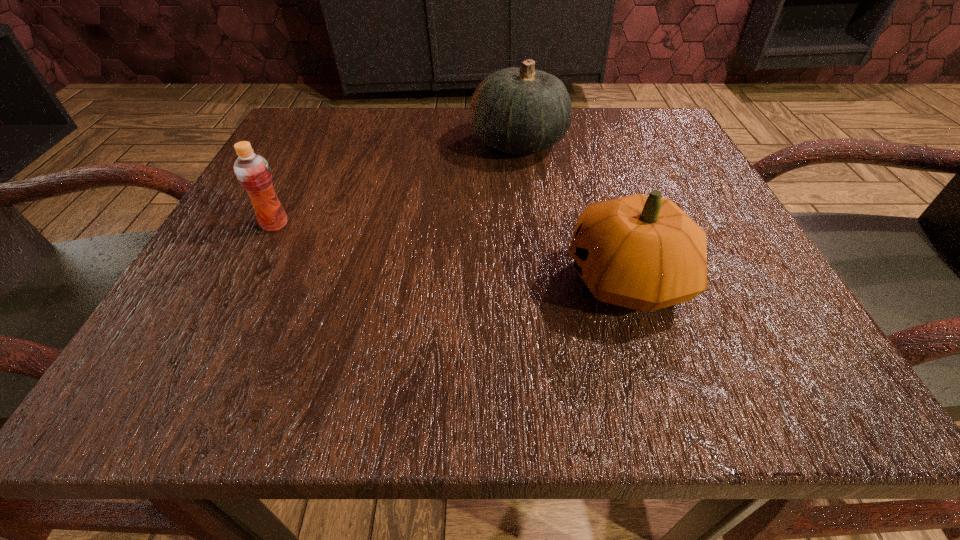
The height and width of the screenshot is (540, 960). I want to click on object present at the left edge, so click(x=252, y=170).

Find the location of a particular element. object that is at the right edge is located at coordinates (643, 252).

At what (x,y) coordinates should I click in order to perform the action: click on vacant region at the far edge of the desktop. Please return your answer as a coordinate pair (x, y). The width and height of the screenshot is (960, 540). Looking at the image, I should click on (574, 159).

This screenshot has height=540, width=960. I want to click on vacant space at the near edge, so click(633, 380).

The image size is (960, 540). I want to click on vacant position at the left edge of the desktop, so click(241, 244).

I want to click on free location at the right edge of the desktop, so click(x=758, y=277).

The height and width of the screenshot is (540, 960). Identify the location of vacant space at the far left corner of the desktop. (291, 168).

This screenshot has width=960, height=540. In the image, there is a desktop. In order to click on vacant space at the far right corner in this screenshot , I will do `click(620, 168)`.

Locate an element on the screen. This screenshot has height=540, width=960. vacant space at the near right corner of the desktop is located at coordinates pyautogui.click(x=836, y=403).

At what (x,y) coordinates should I click in order to perform the action: click on vacant area between the nearest object and the second farthest object. Please return your answer as a coordinate pair (x, y). Image resolution: width=960 pixels, height=540 pixels. Looking at the image, I should click on (451, 252).